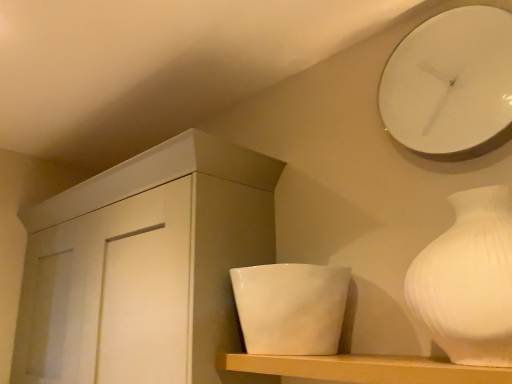
Find the location of `white matte vase at right`. white matte vase at right is located at coordinates (468, 280).

This screenshot has height=384, width=512. I want to click on white glossy clock at upper right, so click(451, 84).

At what (x,y) coordinates should I click in order to perform the action: click on white matte vase at right. Please return your answer as a coordinate pair (x, y). Looking at the image, I should click on (468, 280).

Is white glossy clock at upper right directly adjacent to white matte vase at right?

No, white glossy clock at upper right is not in contact with white matte vase at right.

Is white glossy clock at upper right behind white matte vase at right?

Yes, white glossy clock at upper right is behind white matte vase at right.

Do you think white glossy clock at upper right is within white matte vase at right, or outside of it?

white glossy clock at upper right is located beyond the bounds of white matte vase at right.

Is white glossy clock at upper right oriented away from white matte vase at right?

white glossy clock at upper right is not turned away from white matte vase at right.

Looking at their sizes, would you say white matte cabinet at center is wider or thinner than white glossy clock at upper right?

Clearly, white matte cabinet at center has more width compared to white glossy clock at upper right.

Does white matte cabinet at center contain white glossy clock at upper right?

No, white glossy clock at upper right is not a part of white matte cabinet at center.

Are white matte cabinet at center and white glossy clock at upper right far apart?

No, white matte cabinet at center is not far away from white glossy clock at upper right.

Considering the points (140, 215) and (432, 36), which point is in front, point (140, 215) or point (432, 36)?

The point (432, 36) is closer.

In the scene shown: Is white matte cabinet at center located within white glossy bowl at center?

That's incorrect, white matte cabinet at center is not inside white glossy bowl at center.

Is white glossy bowl at center facing away from white matte cabinet at center?

That's not correct — white glossy bowl at center is not looking away from white matte cabinet at center.

Considering the relative sizes of white matte vase at right and white matte shelf at center in the image provided, is white matte vase at right shorter than white matte shelf at center?

In fact, white matte vase at right may be taller than white matte shelf at center.

Which is behind, white matte vase at right or white matte shelf at center?

white matte shelf at center is more distant.

Could you tell me if white matte vase at right is facing white matte shelf at center?

No, white matte vase at right is not aimed at white matte shelf at center.

Is white matte vase at right not inside white matte shelf at center?

white matte vase at right is positioned outside white matte shelf at center.

Considering the positions of objects white glossy clock at upper right and white glossy bowl at center in the image provided, who is more to the left, white glossy clock at upper right or white glossy bowl at center?

white glossy bowl at center.

Is white glossy clock at upper right aimed at white glossy bowl at center?

No.

I want to click on wall clock to the right of white glossy bowl at center, so click(x=451, y=84).

Is white glossy clock at upper right shorter than white glossy bowl at center?

In fact, white glossy clock at upper right may be taller than white glossy bowl at center.

Is white glossy bowl at center thinner than white matte shelf at center?

Yes.

Is white glossy bowl at center further to the viewer compared to white matte shelf at center?

That is True.

From the picture: Is white glossy bowl at center directly adjacent to white matte shelf at center?

No, white glossy bowl at center is not in contact with white matte shelf at center.

From the picture: From the image's perspective, is white glossy bowl at center above white matte shelf at center?

Yes, from the image's perspective, white glossy bowl at center is over white matte shelf at center.

What's the angular difference between white matte vase at right and white glossy bowl at center's facing directions?

The angle between the facing direction of white matte vase at right and the facing direction of white glossy bowl at center is 0.000151 degrees.

Does point (507, 352) come closer to viewer compared to point (255, 341)?

Yes, it is.

Could you tell me if white matte vase at right is facing white glossy bowl at center?

No, white matte vase at right does not turn towards white glossy bowl at center.

From a real-world perspective, between white matte vase at right and white glossy bowl at center, who is vertically higher?

In real-world perspective, white matte vase at right is above.

This screenshot has height=384, width=512. In order to click on wall clock that appears above the white matte vase at right (from a real-world perspective) in this screenshot , I will do `click(451, 84)`.

Locate an element on the screen. Image resolution: width=512 pixels, height=384 pixels. wall clock above the white matte cabinet at center (from the image's perspective) is located at coordinates (451, 84).

Based on their spatial positions, is white matte cabinet at center or white glossy clock at upper right further from white matte vase at right?

white matte cabinet at center is further to white matte vase at right.

When comparing their distances from white glossy clock at upper right, does white matte cabinet at center or white matte vase at right seem closer?

The object closer to white glossy clock at upper right is white matte vase at right.

Which object lies nearer to the anchor point white matte cabinet at center, white matte shelf at center or white matte vase at right?

white matte shelf at center lies closer to white matte cabinet at center than the other object.

Considering their positions, is white matte shelf at center positioned further to white glossy clock at upper right than white matte cabinet at center?

Based on the image, white matte cabinet at center appears to be further to white glossy clock at upper right.

Estimate the real-world distances between objects in this image. Which object is closer to white matte shelf at center, white glossy bowl at center or white matte cabinet at center?

white glossy bowl at center.

Looking at the image, which one is located further to white matte shelf at center, white matte vase at right or white glossy clock at upper right?

white glossy clock at upper right lies further to white matte shelf at center than the other object.

When comparing their distances from white glossy bowl at center, does white glossy clock at upper right or white matte shelf at center seem further?

white glossy clock at upper right is positioned further to the anchor white glossy bowl at center.

Considering their positions, is white glossy bowl at center positioned further to white matte cabinet at center than white matte shelf at center?

white matte shelf at center lies further to white matte cabinet at center than the other object.

At what (x,y) coordinates should I click in order to perform the action: click on vase that lies between white glossy clock at upper right and white matte shelf at center from top to bottom. Please return your answer as a coordinate pair (x, y). This screenshot has height=384, width=512. Looking at the image, I should click on click(468, 280).

I want to click on vase between white matte cabinet at center and white glossy clock at upper right in the horizontal direction, so click(468, 280).

Locate an element on the screen. vase between white glossy clock at upper right and white glossy bowl at center in the vertical direction is located at coordinates (468, 280).

Where is `ceramic situated between white matte cabinet at center and white matte vase at right from left to right`? This screenshot has height=384, width=512. ceramic situated between white matte cabinet at center and white matte vase at right from left to right is located at coordinates (291, 307).